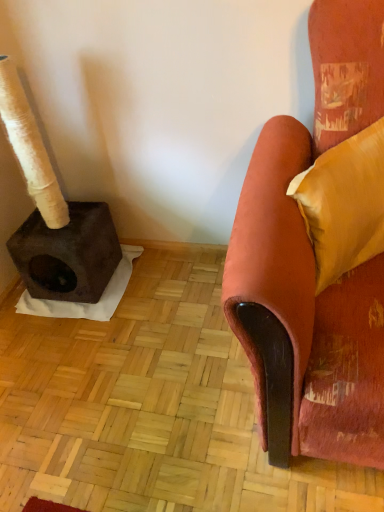
Question: Considering the positions of velvet yellow pillow at right and velvet orange armchair at right in the image, is velvet yellow pillow at right taller or shorter than velvet orange armchair at right?

Choices:
 (A) short
 (B) tall

Answer: (A)

Question: Looking at the image, does velvet yellow pillow at right seem bigger or smaller compared to velvet orange armchair at right?

Choices:
 (A) small
 (B) big

Answer: (A)

Question: Is point [317, 269] positioned closer to the camera than point [259, 345]?

Choices:
 (A) closer
 (B) farther

Answer: (B)

Question: Is velvet orange armchair at right wider or thinner than velvet yellow pillow at right?

Choices:
 (A) wide
 (B) thin

Answer: (A)

Question: Is velvet orange armchair at right situated inside velvet yellow pillow at right or outside?

Choices:
 (A) inside
 (B) outside

Answer: (B)

Question: Considering the positions of velvet orange armchair at right and velvet yellow pillow at right in the image, is velvet orange armchair at right taller or shorter than velvet yellow pillow at right?

Choices:
 (A) tall
 (B) short

Answer: (A)

Question: From a real-world perspective, is velvet orange armchair at right physically located above or below velvet yellow pillow at right?

Choices:
 (A) below
 (B) above

Answer: (A)